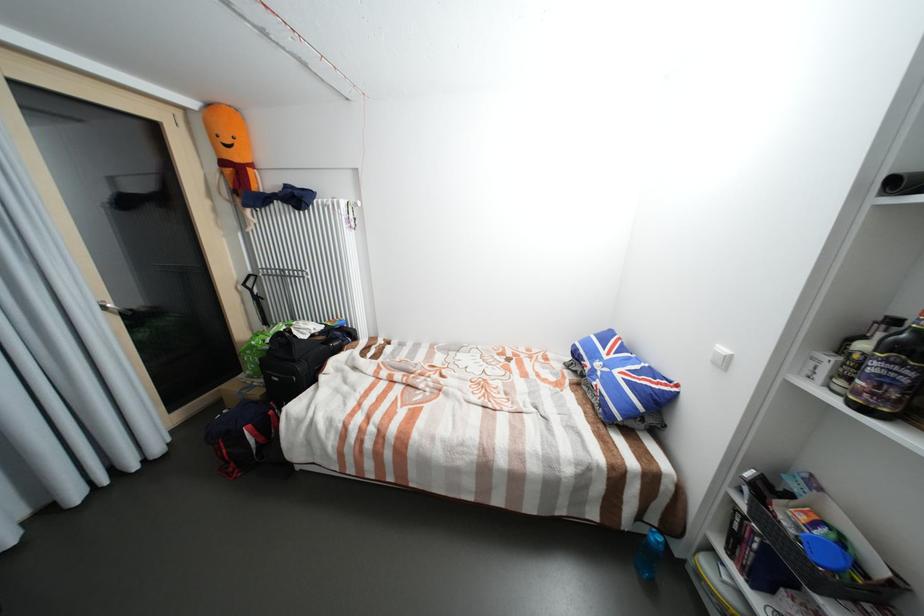
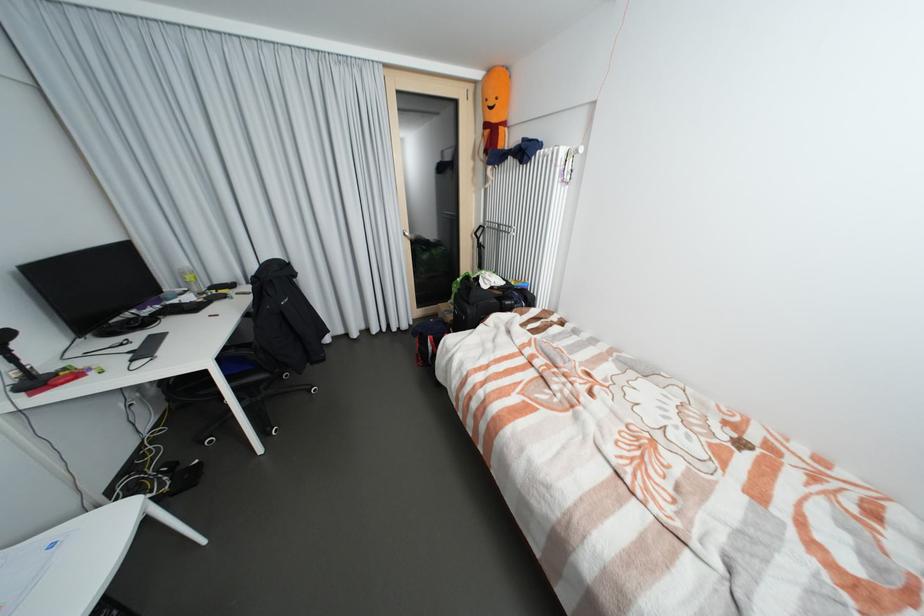
Find the pixel in the second image that matches the point at 143,321 in the first image.

(426, 246)